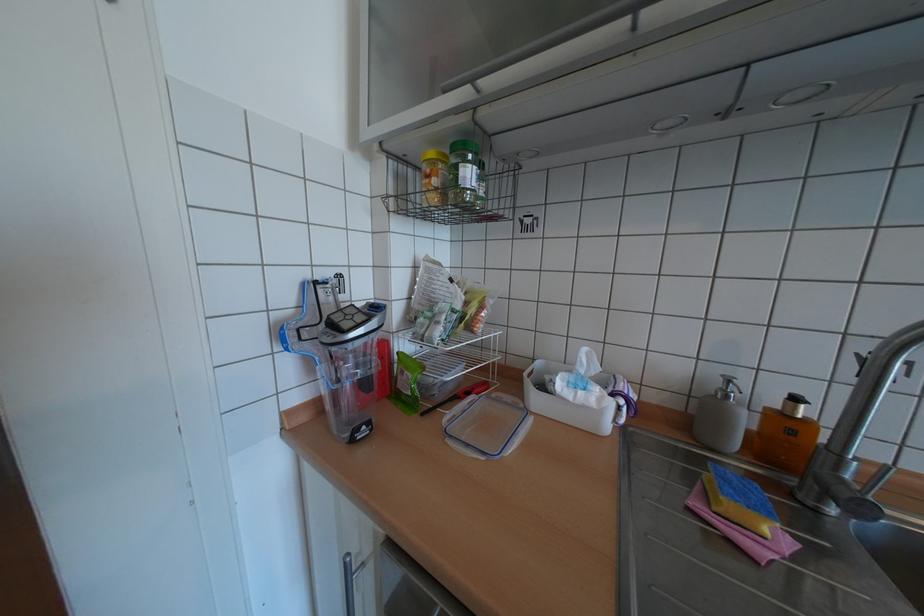
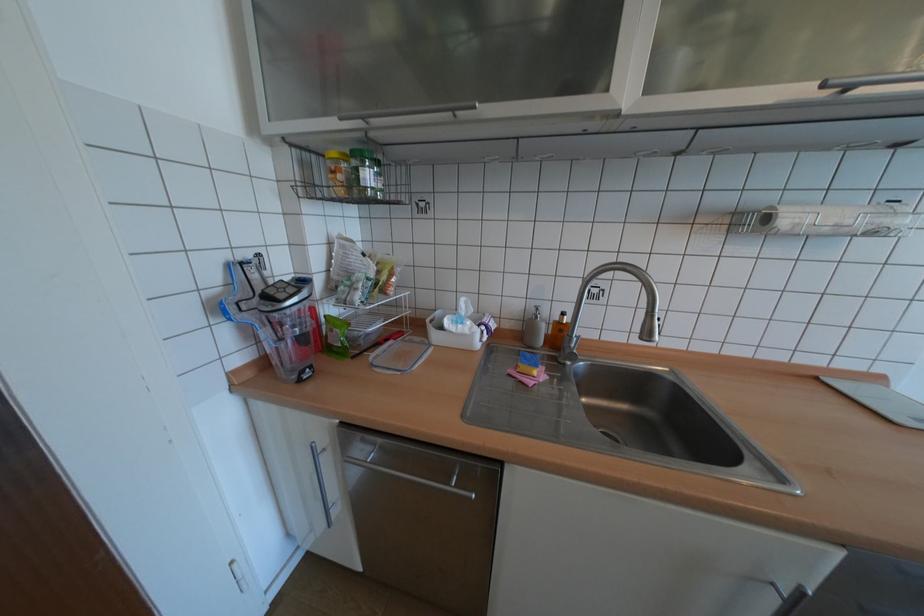
Locate, in the second image, the point that corresponds to [736,397] in the first image.

(545, 317)